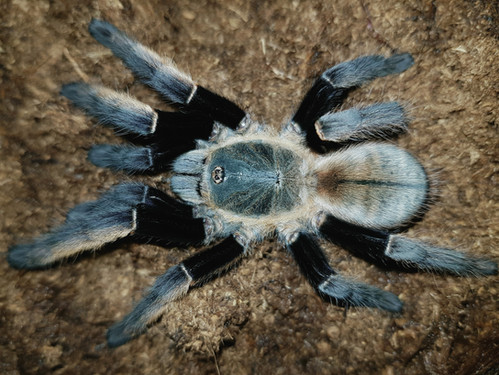
Find the location of a particular element. The image size is (499, 375). bottom right leg is located at coordinates (341, 279).